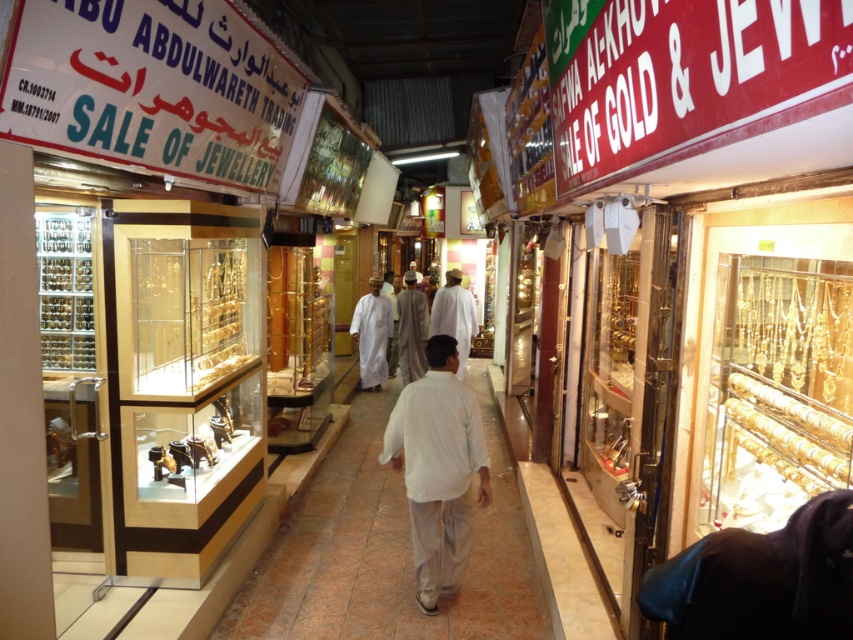
You are a customer in the gold and jewelry market and see a man wearing a white cotton shirt at center and a white cotton robe at center. Which clothing item is positioned lower on his body?

The white cotton shirt at center is positioned lower on his body since it is below the white cotton robe at center.

You are a customer in the gold market and see a white cotton shirt at center and a white cloth at center. Which item is positioned lower in the scene?

The white cotton shirt at center is below the white cloth at center, so it is positioned lower in the scene.